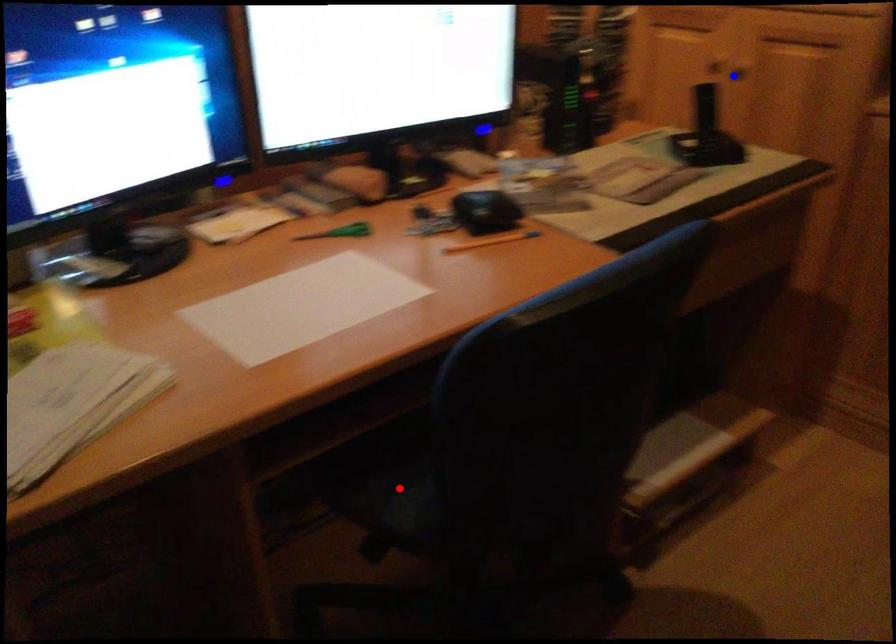
Question: Two points are marked on the image. Which point is closer to the camera?

Choices:
 (A) Blue point is closer.
 (B) Red point is closer.

Answer: (B)